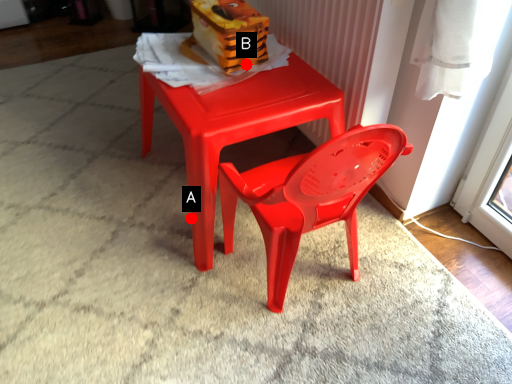
Question: Two points are circled on the image, labeled by A and B beside each circle. Among these points, which one is farthest from the camera?

Choices:
 (A) A is further
 (B) B is further

Answer: (A)